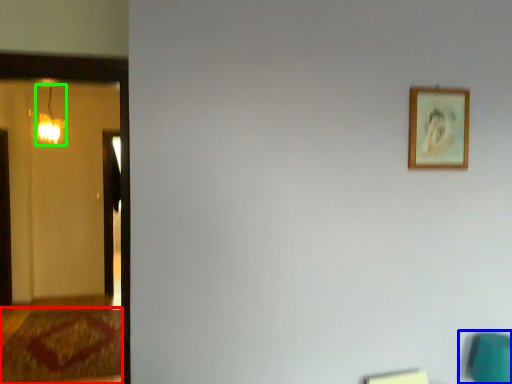
Question: Considering the real-world distances, which object is closest to doormat (highlighted by a red box)? swivel chair (highlighted by a blue box) or lamp (highlighted by a green box).

Choices:
 (A) swivel chair
 (B) lamp

Answer: (B)